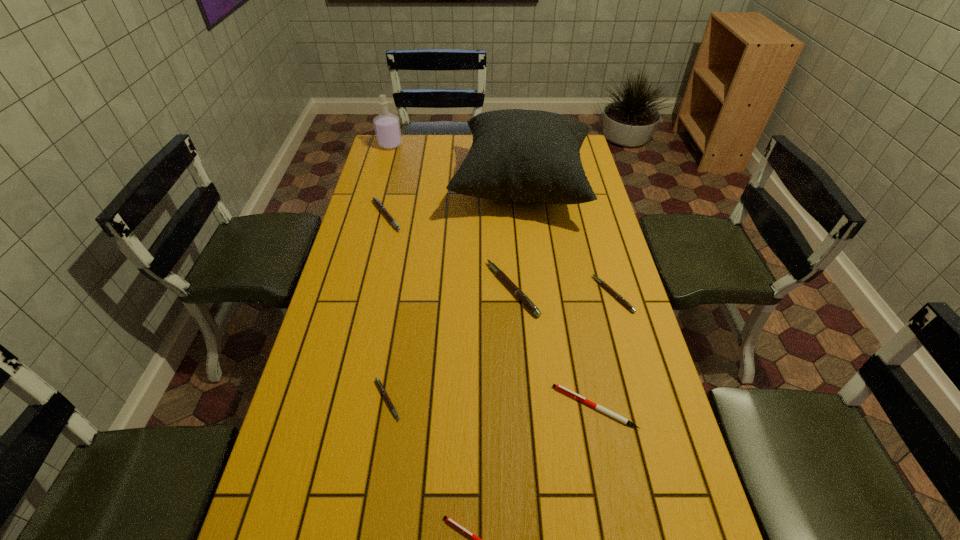
Where is `free space located 0.160m at the nib of the third biggest pink pen`? This screenshot has width=960, height=540. free space located 0.160m at the nib of the third biggest pink pen is located at coordinates (543, 294).

At what (x,y) coordinates should I click in order to perform the action: click on free region located 0.220m at the nib of the third biggest pink pen. Please return your answer as a coordinate pair (x, y). Image resolution: width=960 pixels, height=540 pixels. Looking at the image, I should click on (523, 294).

At what (x,y) coordinates should I click in order to perform the action: click on vacant region located on the clicker of the right white pen. Please return your answer as a coordinate pair (x, y). Looking at the image, I should click on (502, 407).

At what (x,y) coordinates should I click in order to perform the action: click on vacant region located 0.290m on the clicker of the right white pen. Please return your answer as a coordinate pair (x, y). The width and height of the screenshot is (960, 540). Looking at the image, I should click on (437, 407).

Find the location of a particular element. This screenshot has width=960, height=540. free spot located 0.390m on the clicker of the right white pen is located at coordinates (396, 407).

This screenshot has width=960, height=540. Identify the location of vacant space located 0.320m at the nib of the smallest pink pen. (532, 400).

You are a GUI agent. You are given a task and a screenshot of the screen. Output one action in this format:
    pyautogui.click(x=<x>, y=<y>)
    Task: Click on the cushion that is at the far edge
    
    Given the screenshot: What is the action you would take?
    pyautogui.click(x=530, y=156)

Identify the location of perfume that is at the far edge. This screenshot has width=960, height=540. (387, 126).

Locate an element on the screen. This screenshot has width=960, height=540. perfume that is at the left edge is located at coordinates (387, 126).

You are a GUI agent. You are given a task and a screenshot of the screen. Output one action in this format:
    pyautogui.click(x=<x>, y=<y>)
    Task: Click on the pen that is at the left edge
    
    Given the screenshot: What is the action you would take?
    click(x=376, y=201)